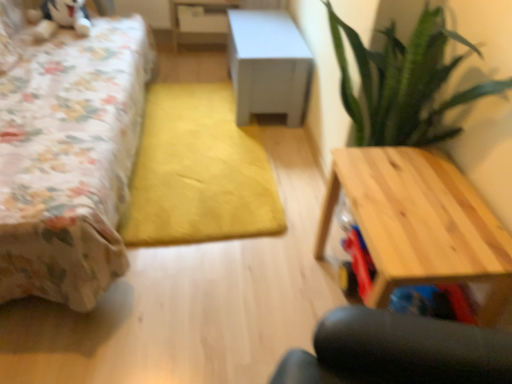
Locate an element on the screen. free space to the left of white matte cabinet at center, positioned as the second table in front-to-back order is located at coordinates (191, 91).